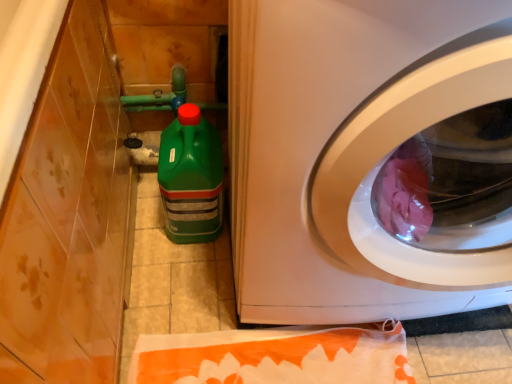
Question: Is green plastic bottle at lower left inside the boundaries of white glossy washing machine at center, or outside?

Choices:
 (A) inside
 (B) outside

Answer: (B)

Question: Based on their sizes in the image, would you say green plastic bottle at lower left is bigger or smaller than white glossy washing machine at center?

Choices:
 (A) small
 (B) big

Answer: (A)

Question: From a real-world perspective, is green plastic bottle at lower left above or below white glossy washing machine at center?

Choices:
 (A) above
 (B) below

Answer: (B)

Question: Based on their positions, is white glossy washing machine at center located to the left or right of green plastic bottle at lower left?

Choices:
 (A) right
 (B) left

Answer: (A)

Question: Relative to green plastic bottle at lower left, is white glossy washing machine at center in front or behind?

Choices:
 (A) front
 (B) behind

Answer: (A)

Question: Considering the positions of white glossy washing machine at center and green plastic bottle at lower left in the image, is white glossy washing machine at center taller or shorter than green plastic bottle at lower left?

Choices:
 (A) tall
 (B) short

Answer: (A)

Question: Based on their sizes in the image, would you say white glossy washing machine at center is bigger or smaller than green plastic bottle at lower left?

Choices:
 (A) small
 (B) big

Answer: (B)